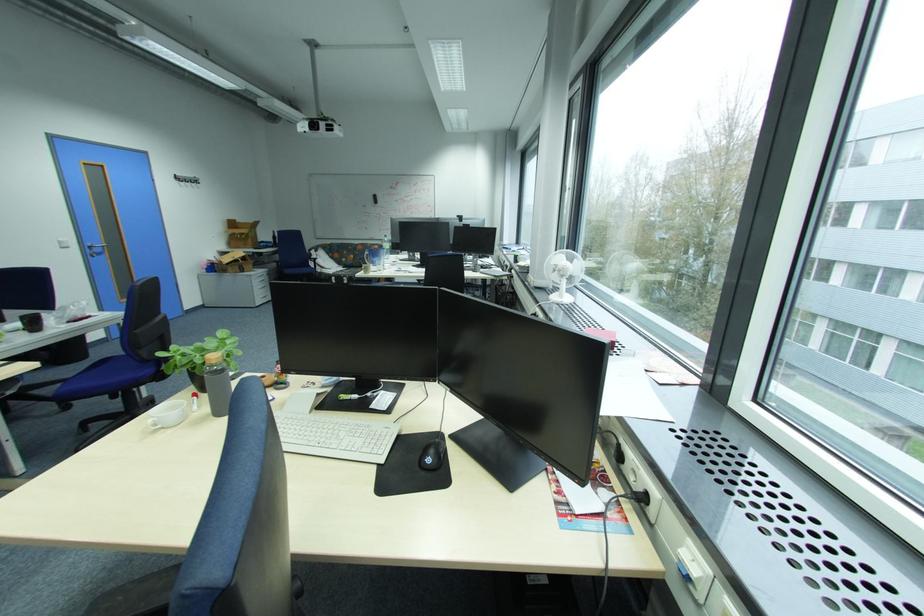
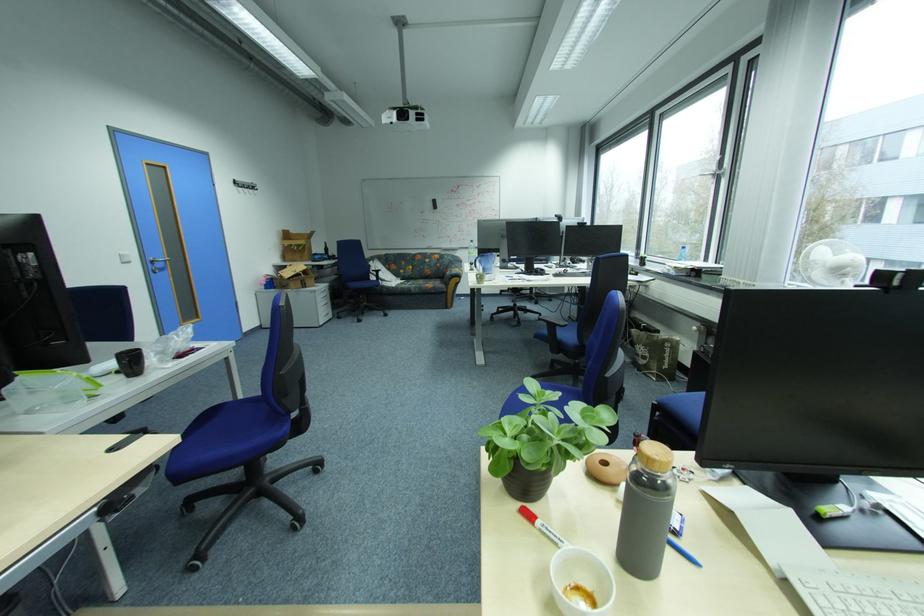
Based on the photo, what movement of the cameraman would produce the second image?

The cameraman walked toward left, forward.